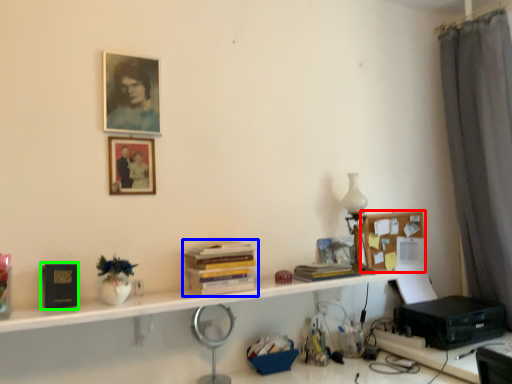
Question: Based on their relative distances, which object is farther from bulletin board (highlighted by a red box)? Choose from book (highlighted by a blue box) and paperback book (highlighted by a green box).

Choices:
 (A) book
 (B) paperback book

Answer: (B)